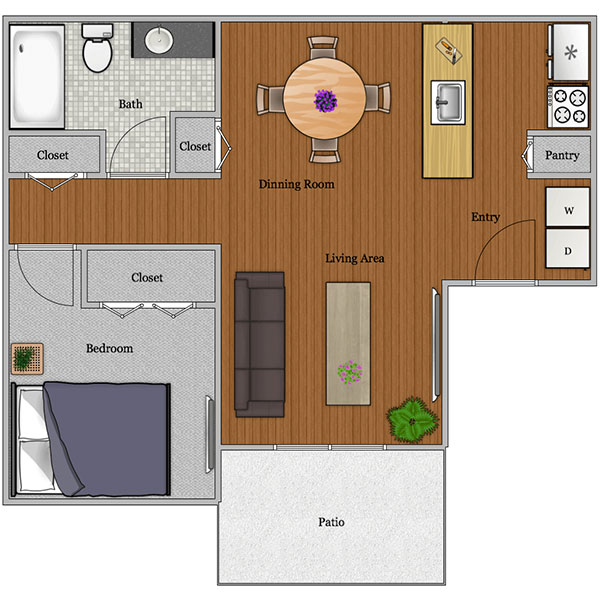
The image size is (600, 600). I want to click on area between bedroom and bathroom, so click(116, 213).